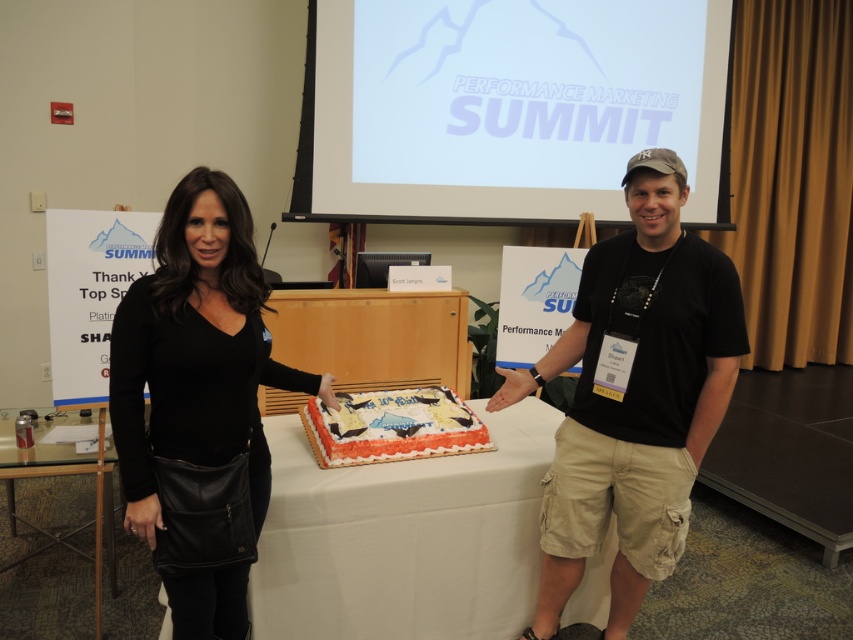
Question: Is white matte projection screen at upper center above black cotton t-shirt at center?

Choices:
 (A) yes
 (B) no

Answer: (A)

Question: Among these points, which one is nearest to the camera?

Choices:
 (A) (231, 412)
 (B) (102, 412)

Answer: (A)

Question: Is white matte projection screen at upper center closer to the viewer compared to black cotton t-shirt at center?

Choices:
 (A) yes
 (B) no

Answer: (B)

Question: Does black cotton t-shirt at center appear on the right side of white frosted cake at center?

Choices:
 (A) no
 (B) yes

Answer: (B)

Question: Which point is closer to the camera?

Choices:
 (A) black leather purse at left
 (B) white frosted cake at center
 (C) black cotton t-shirt at center
 (D) clear glass table at lower left

Answer: (A)

Question: Based on their relative distances, which object is nearer to the black cotton t-shirt at center?

Choices:
 (A) white cloth at center
 (B) white matte projection screen at upper center
 (C) white frosted cake at center
 (D) black matte cake at center

Answer: (D)